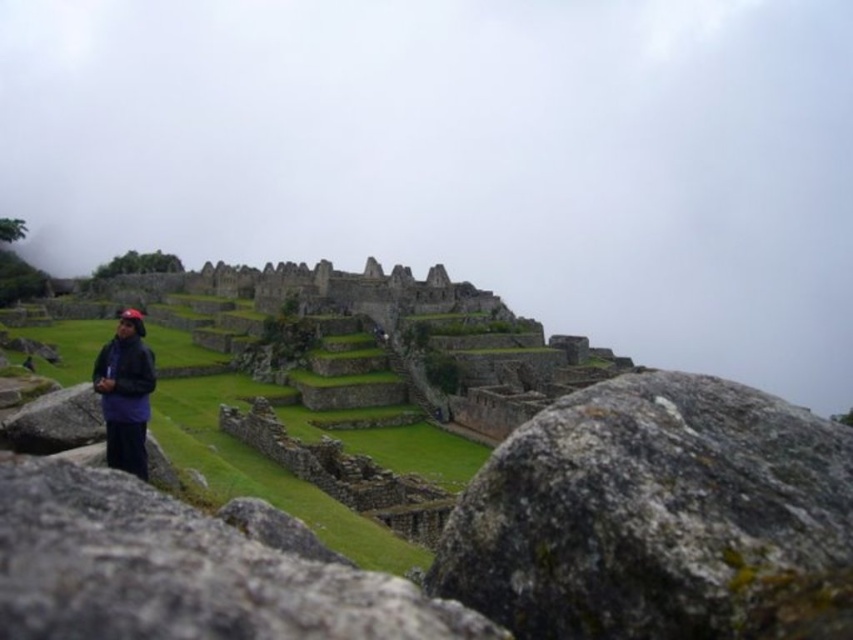
Is white fog at upper center bigger than gray rough stone at center?

Yes.

Can you confirm if white fog at upper center is positioned above gray rough stone at center?

Yes.

You are a GUI agent. You are given a task and a screenshot of the screen. Output one action in this format:
    pyautogui.click(x=<x>, y=<y>)
    Task: Click on the white fog at upper center
    This screenshot has height=640, width=853.
    Given the screenshot: What is the action you would take?
    pyautogui.click(x=466, y=157)